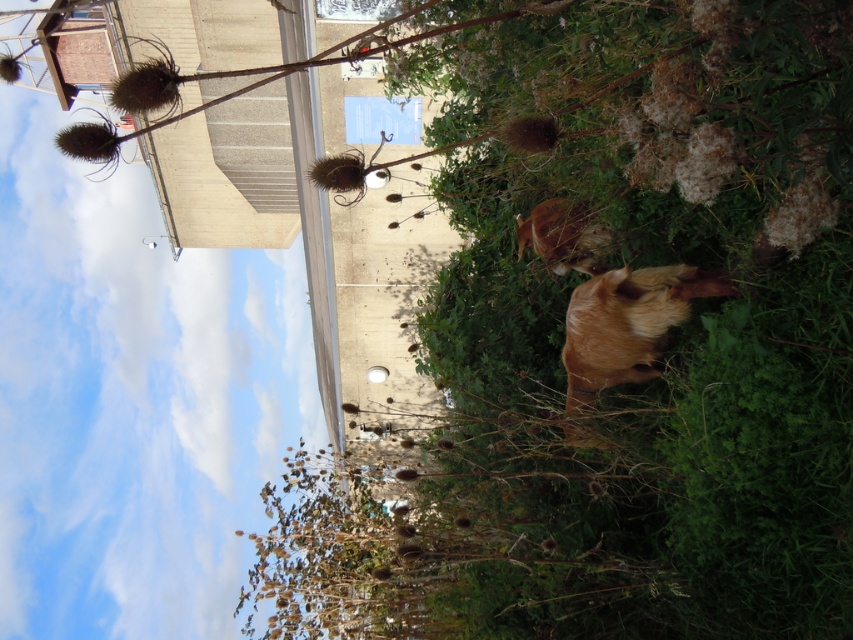
Is brown fuzzy plant at center positioned behind brown furry dog at center?

No.

Is brown fuzzy plant at center closer to the viewer compared to brown furry dog at center?

Yes.

Who is more forward, (827, 198) or (554, 250)?

Point (827, 198)

This screenshot has width=853, height=640. I want to click on brown fuzzy plant at center, so click(x=630, y=358).

Does golden fur goat at center appear on the left side of brown furry dog at center?

Incorrect, golden fur goat at center is not on the left side of brown furry dog at center.

Identify the location of golden fur goat at center. (624, 330).

Locate an element on the screen. This screenshot has height=640, width=853. golden fur goat at center is located at coordinates (624, 330).

Does brown fuzzy plant at center have a lesser width compared to golden fur goat at center?

In fact, brown fuzzy plant at center might be wider than golden fur goat at center.

Which is behind, point (669, 100) or point (614, 353)?

Point (614, 353)

In order to click on brown fuzzy plant at center in this screenshot , I will do point(630,358).